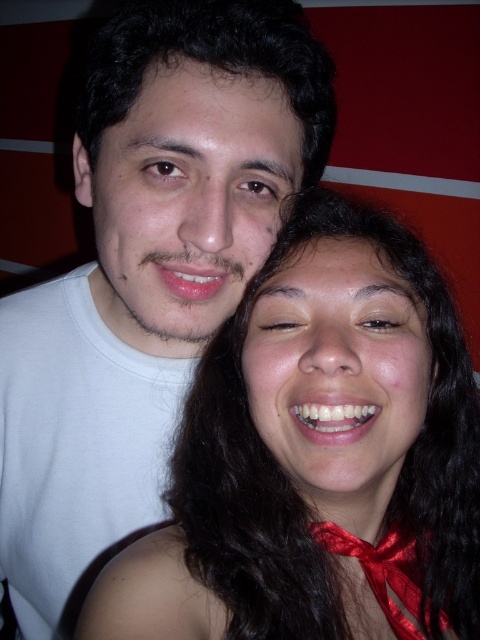
Based on the scene description, can you identify the object located at the coordinates point (319, 456)?

The object at point (319, 456) is the smooth skin face at center.